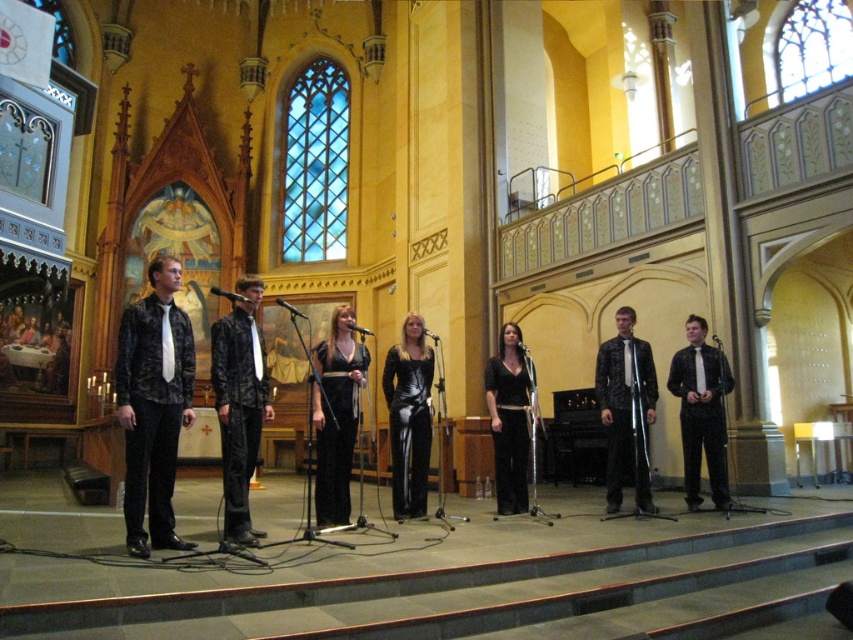
Where is `black satin dress at center`? The image size is (853, 640). black satin dress at center is located at coordinates (335, 416).

Describe the element at coordinates (335, 416) in the screenshot. The height and width of the screenshot is (640, 853). I see `black satin dress at center` at that location.

Where is `black satin dress at center`? Image resolution: width=853 pixels, height=640 pixels. black satin dress at center is located at coordinates (335, 416).

Consider the image. Between black satin dress at center and shiny black suit at center, which one appears on the right side from the viewer's perspective?

Positioned to the right is shiny black suit at center.

Which is in front, point (320, 486) or point (642, 456)?

Point (320, 486) is more forward.

Does point (328, 420) lie behind point (625, 376)?

No, (328, 420) is in front of (625, 376).

Where is `black satin dress at center`? black satin dress at center is located at coordinates (335, 416).

Is the position of black leather dress at center more distant than that of black velvet dress at center?

That is False.

Does black leather dress at center have a greater width compared to black velvet dress at center?

Yes, black leather dress at center is wider than black velvet dress at center.

Who is more distant from viewer, (419, 403) or (503, 456)?

The point (503, 456) is more distant.

Locate an element on the screen. Image resolution: width=853 pixels, height=640 pixels. black leather dress at center is located at coordinates (409, 417).